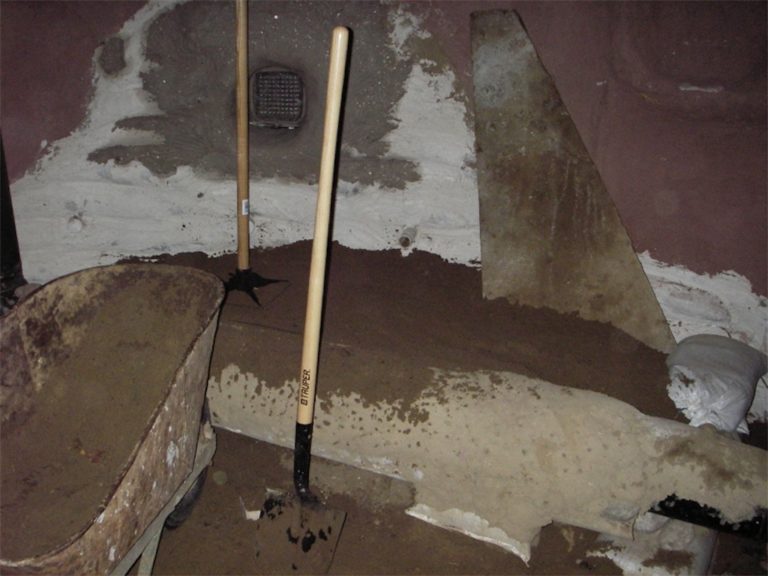
Where is `top of handle`? This screenshot has height=576, width=768. top of handle is located at coordinates (343, 37), (243, 3).